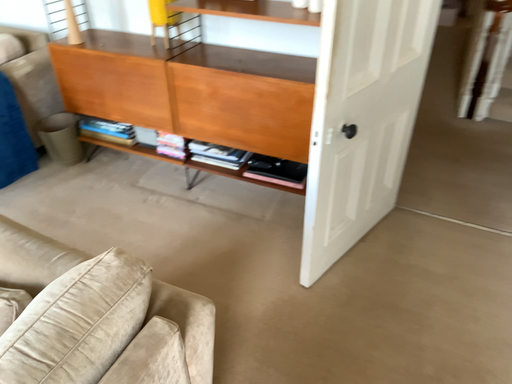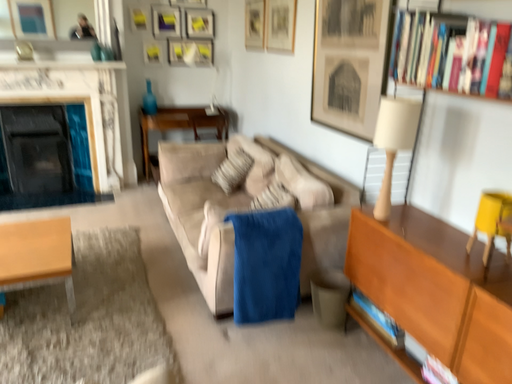
Question: Which way did the camera rotate in the video?

Choices:
 (A) rotated upward
 (B) rotated downward

Answer: (A)